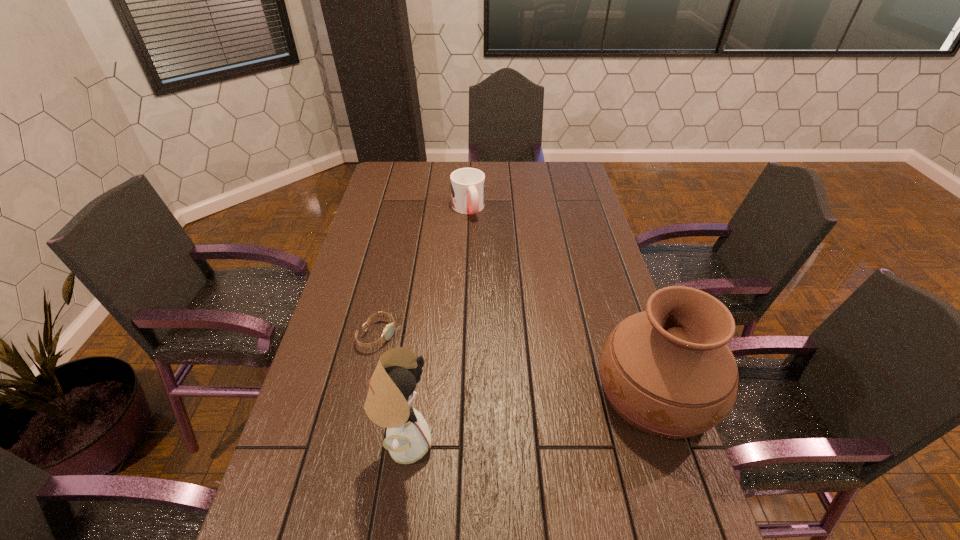
Where is `vacant space situated on the face of the shortest object`? The image size is (960, 540). vacant space situated on the face of the shortest object is located at coordinates (498, 387).

Where is `vacant space located 0.210m on the face of the shortest object`? vacant space located 0.210m on the face of the shortest object is located at coordinates (457, 370).

I want to click on vacant point located 0.160m on the face of the shortest object, so click(441, 363).

You are a GUI agent. You are given a task and a screenshot of the screen. Output one action in this format:
    pyautogui.click(x=<x>, y=<y>)
    Task: Click on the object that is at the left edge
    This screenshot has height=540, width=960.
    Given the screenshot: What is the action you would take?
    pyautogui.click(x=388, y=331)

Find the location of a particular element. The height and width of the screenshot is (540, 960). object that is at the right edge is located at coordinates (668, 371).

In the image, there is a desktop. Where is `vacant space at the left edge`? The width and height of the screenshot is (960, 540). vacant space at the left edge is located at coordinates (357, 402).

What are the coordinates of `vacant space at the right edge of the desktop` in the screenshot? It's located at (652, 446).

Locate an element on the screen. This screenshot has width=960, height=540. vacant position at the near right corner of the desktop is located at coordinates (622, 516).

Identify the location of vacant space that's between the doll and the urn. The height and width of the screenshot is (540, 960). (530, 417).

Image resolution: width=960 pixels, height=540 pixels. Identify the location of empty space that is in between the mug and the rightmost object. (562, 300).